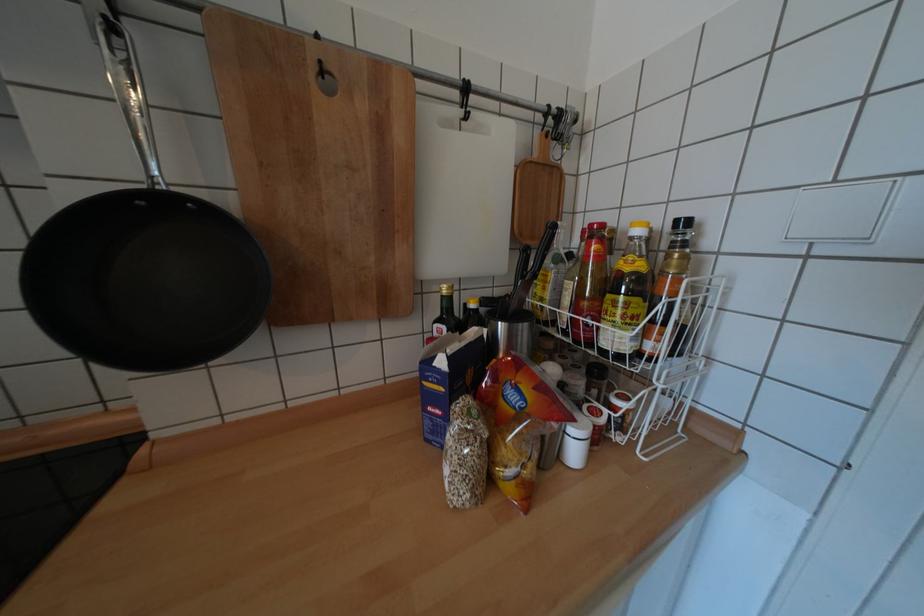
The width and height of the screenshot is (924, 616). In order to click on cutting board hole in this screenshot , I will do click(327, 84).